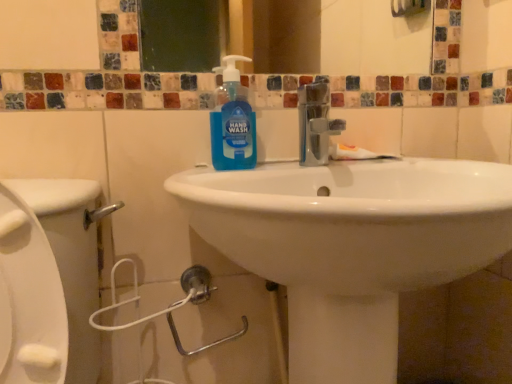
Question: Considering the relative positions of blue translucent hand wash at center and white matte toothpaste at center in the image provided, is blue translucent hand wash at center to the right of white matte toothpaste at center from the viewer's perspective?

Choices:
 (A) yes
 (B) no

Answer: (B)

Question: Is blue translucent hand wash at center facing away from white matte toothpaste at center?

Choices:
 (A) yes
 (B) no

Answer: (B)

Question: Considering the relative sizes of blue translucent hand wash at center and white matte toothpaste at center in the image provided, is blue translucent hand wash at center taller than white matte toothpaste at center?

Choices:
 (A) yes
 (B) no

Answer: (A)

Question: Does blue translucent hand wash at center appear on the left side of white matte toothpaste at center?

Choices:
 (A) yes
 (B) no

Answer: (A)

Question: Would you say blue translucent hand wash at center contains white matte toothpaste at center?

Choices:
 (A) yes
 (B) no

Answer: (B)

Question: Is white glossy sink at center taller or shorter than white matte toothpaste at center?

Choices:
 (A) tall
 (B) short

Answer: (A)

Question: In terms of width, does white glossy sink at center look wider or thinner when compared to white matte toothpaste at center?

Choices:
 (A) wide
 (B) thin

Answer: (A)

Question: In the image, is white glossy sink at center positioned in front of or behind white matte toothpaste at center?

Choices:
 (A) front
 (B) behind

Answer: (A)

Question: Is white glossy sink at center to the left or to the right of white matte toothpaste at center in the image?

Choices:
 (A) left
 (B) right

Answer: (A)

Question: From the image's perspective, relative to white glossy sink at center, is white matte toothpaste at center above or below?

Choices:
 (A) above
 (B) below

Answer: (A)

Question: Based on their positions, is white matte toothpaste at center located to the left or right of white glossy sink at center?

Choices:
 (A) left
 (B) right

Answer: (B)

Question: Choose the correct answer: Is white matte toothpaste at center inside white glossy sink at center or outside it?

Choices:
 (A) outside
 (B) inside

Answer: (B)

Question: Considering the positions of white matte toothpaste at center and white glossy sink at center in the image, is white matte toothpaste at center taller or shorter than white glossy sink at center?

Choices:
 (A) tall
 (B) short

Answer: (B)

Question: From a real-world perspective, is white matte toothpaste at center physically located above or below blue translucent hand wash at center?

Choices:
 (A) above
 (B) below

Answer: (B)

Question: From the image's perspective, is white matte toothpaste at center located above or below blue translucent hand wash at center?

Choices:
 (A) below
 (B) above

Answer: (A)